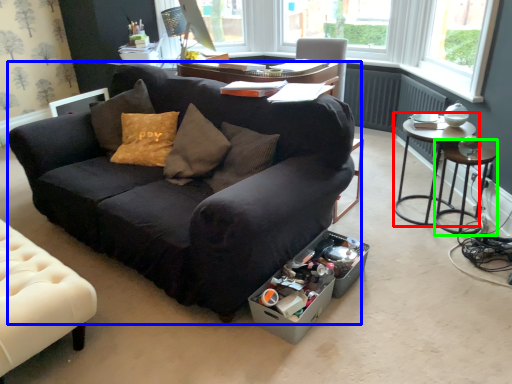
Question: Estimate the real-world distances between objects in this image. Which object is farther from table (highlighted by a red box), studio couch (highlighted by a blue box) or side table (highlighted by a green box)?

Choices:
 (A) studio couch
 (B) side table

Answer: (A)